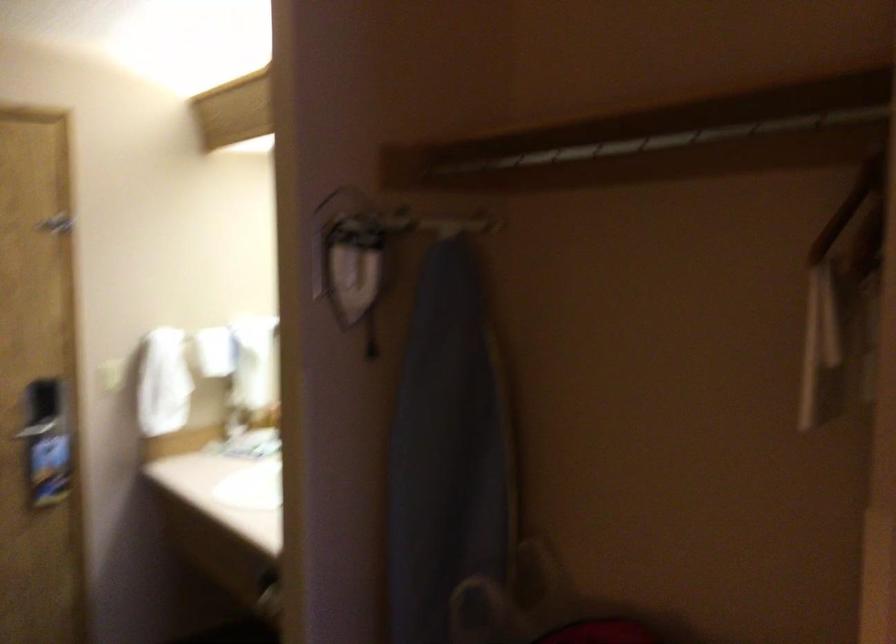
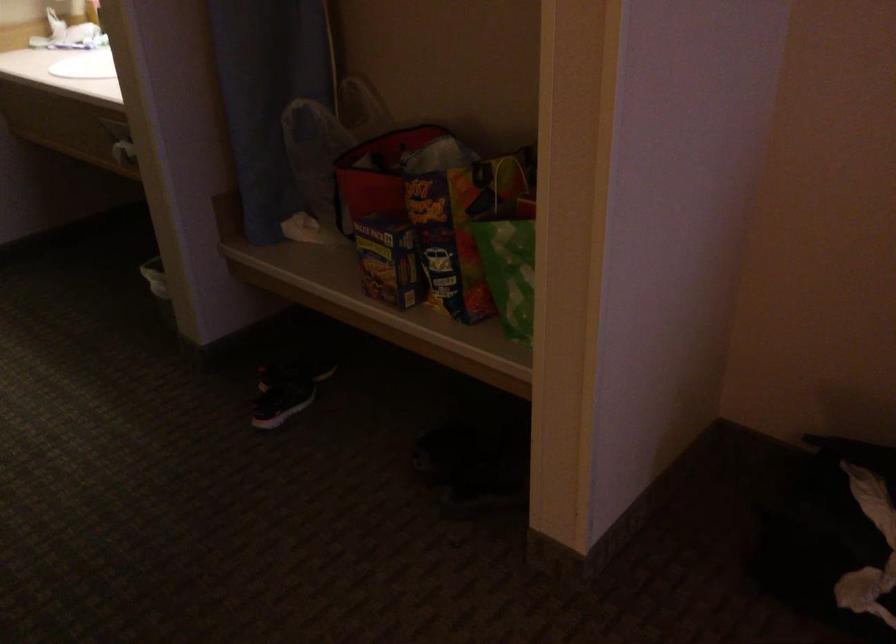
Question: The images are taken continuously from a first-person perspective. In which direction is your viewpoint rotating?

Choices:
 (A) Left
 (B) Right
 (C) Up
 (D) Down

Answer: (D)